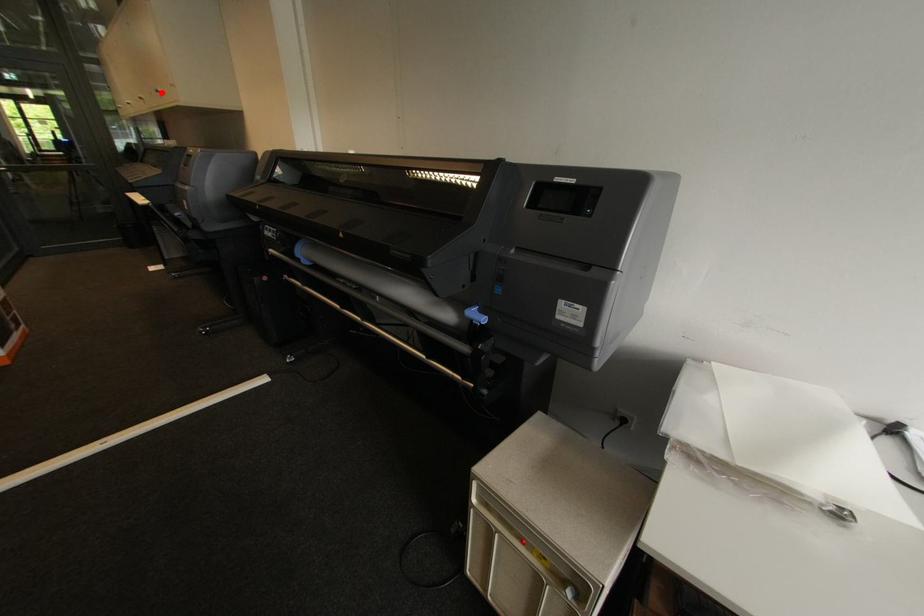
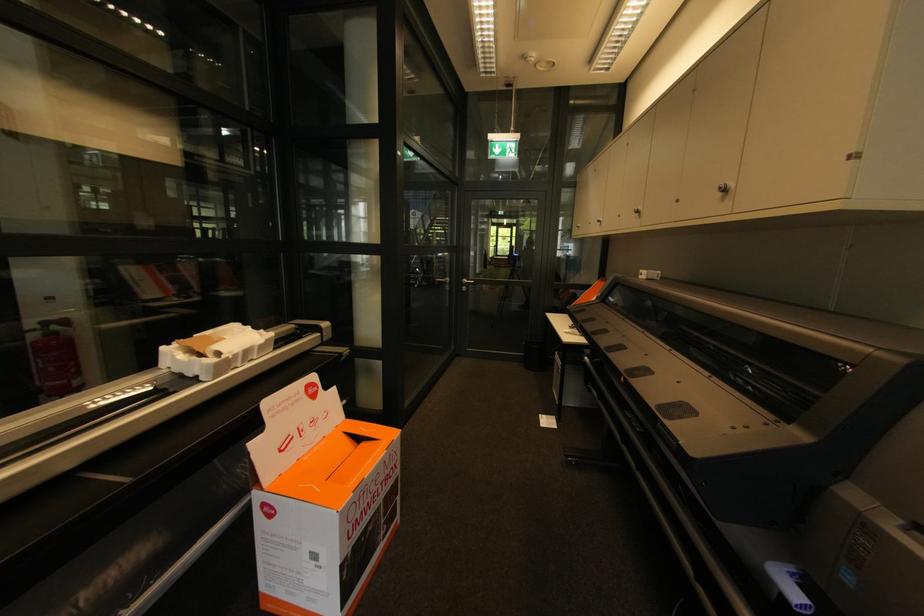
Locate, in the second image, the point that corresponds to the highlighted location in the first image.

(727, 191)